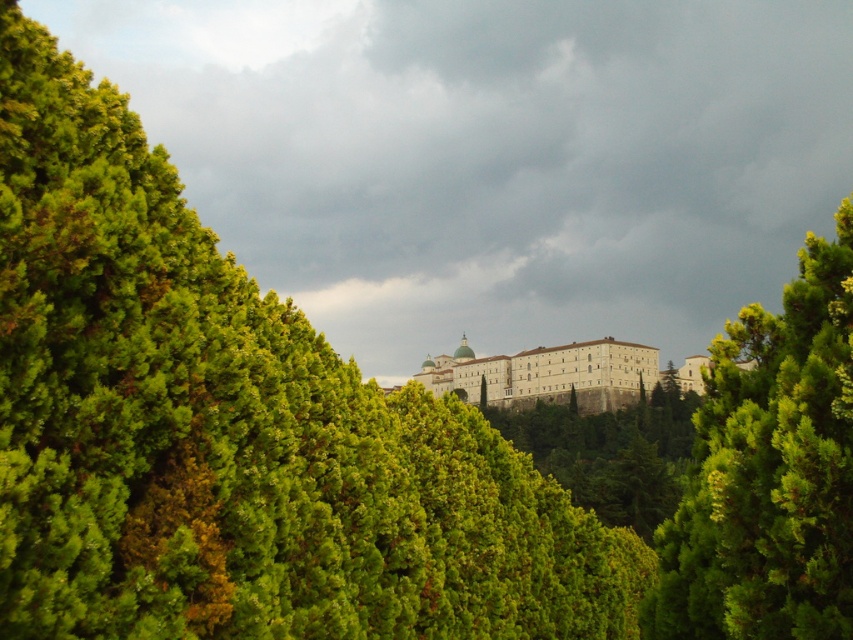
Question: Is green leafy tree at right positioned in front of white stone building at center?

Choices:
 (A) yes
 (B) no

Answer: (A)

Question: Among these points, which one is farthest from the camera?

Choices:
 (A) (489, 371)
 (B) (387, 275)

Answer: (B)

Question: Is dark gray cloud at upper center thinner than white stone building at center?

Choices:
 (A) no
 (B) yes

Answer: (A)

Question: Does dark gray cloud at upper center have a greater width compared to white stone building at center?

Choices:
 (A) yes
 (B) no

Answer: (A)

Question: Which point is closer to the camera taking this photo?

Choices:
 (A) (320, 173)
 (B) (579, 372)
 (C) (820, 554)

Answer: (C)

Question: Considering the real-world distances, which object is farthest from the green leafy tree at right?

Choices:
 (A) white stone building at center
 (B) dark gray cloud at upper center

Answer: (B)